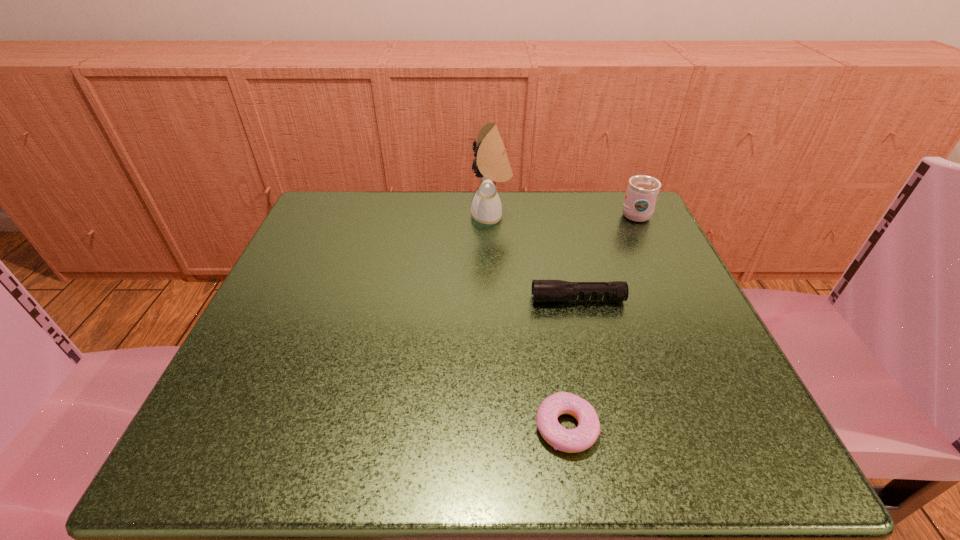
I want to click on the tallest object, so click(493, 166).

You are a GUI agent. You are given a task and a screenshot of the screen. Output one action in this format:
    pyautogui.click(x=<x>, y=<y>)
    Task: Click on the leftmost object
    The height and width of the screenshot is (540, 960).
    Given the screenshot: What is the action you would take?
    pyautogui.click(x=493, y=166)

Where is `the second tallest object`? This screenshot has height=540, width=960. the second tallest object is located at coordinates (642, 191).

The width and height of the screenshot is (960, 540). I want to click on the rightmost object, so click(642, 191).

The image size is (960, 540). In order to click on the second nearest object in this screenshot , I will do `click(543, 291)`.

Identify the location of the third tallest object. (543, 291).

Image resolution: width=960 pixels, height=540 pixels. In order to click on the shortest object in this screenshot , I will do `click(579, 439)`.

The width and height of the screenshot is (960, 540). Identify the location of doughnut. (579, 439).

Find the location of a particular element. The image size is (960, 540). vacant space located 0.270m at the front face of the doll is located at coordinates (349, 217).

Find the location of a particular element. free location located at the front face of the doll is located at coordinates (425, 217).